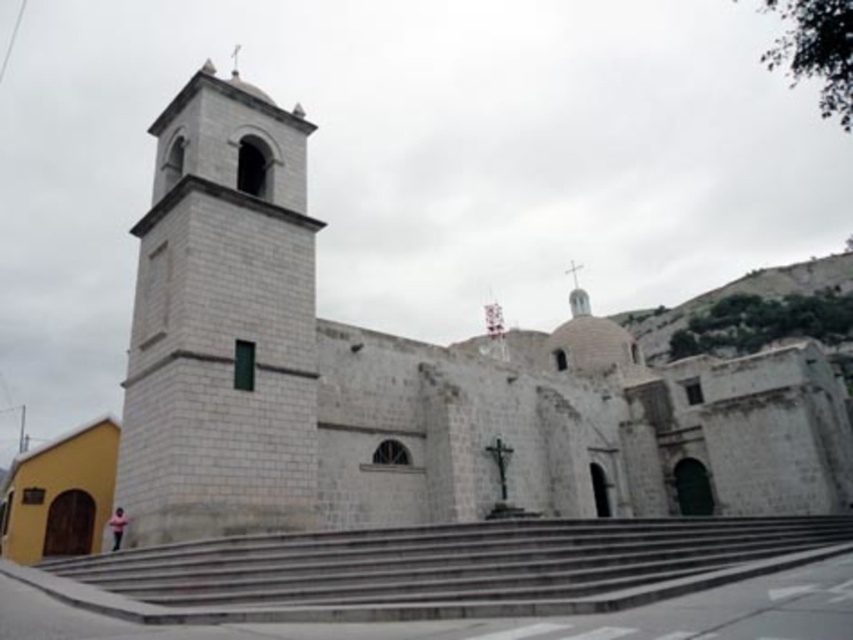
Question: Which object appears farthest from the camera in this image?

Choices:
 (A) gray concrete stairs at center
 (B) white stone bell tower at left

Answer: (B)

Question: Which object appears farthest from the camera in this image?

Choices:
 (A) white stone bell tower at left
 (B) gray concrete stairs at center

Answer: (A)

Question: Does white stone bell tower at left have a lesser width compared to gray concrete stairs at center?

Choices:
 (A) no
 (B) yes

Answer: (B)

Question: Is white stone bell tower at left closer to the viewer compared to gray concrete stairs at center?

Choices:
 (A) no
 (B) yes

Answer: (A)

Question: Does white stone bell tower at left have a greater width compared to gray concrete stairs at center?

Choices:
 (A) yes
 (B) no

Answer: (B)